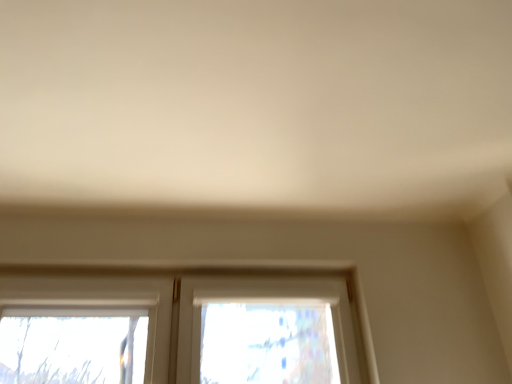
Where is `white plastic window at center`? white plastic window at center is located at coordinates (275, 302).

What do you see at coordinates (275, 302) in the screenshot? The height and width of the screenshot is (384, 512). I see `white plastic window at center` at bounding box center [275, 302].

The height and width of the screenshot is (384, 512). In order to click on white plastic window at center in this screenshot , I will do `click(275, 302)`.